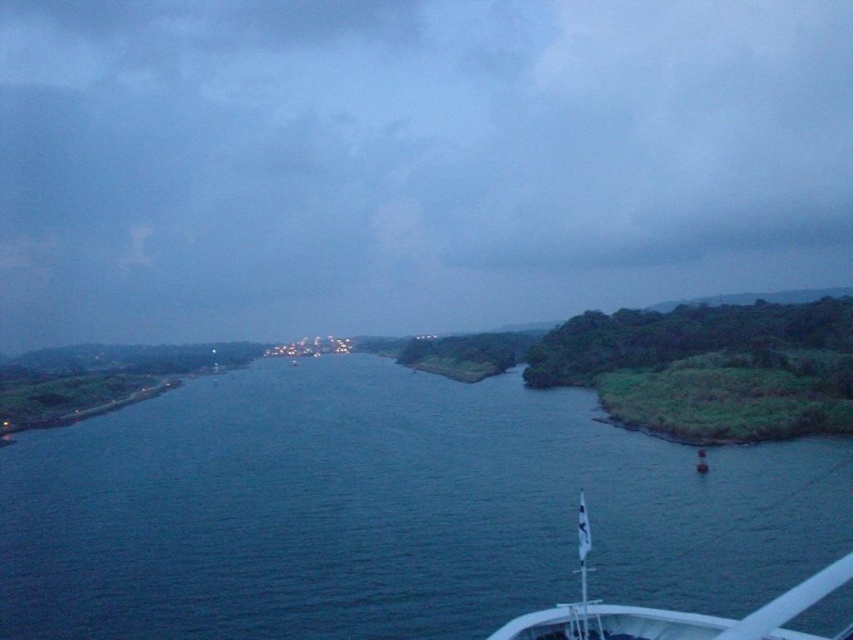
Question: Does dark blue water at center appear on the right side of white matte boat at lower right?

Choices:
 (A) no
 (B) yes

Answer: (A)

Question: Which object is farther from the camera taking this photo?

Choices:
 (A) dark blue water at center
 (B) white matte boat at lower right

Answer: (A)

Question: Is dark blue water at center further to the viewer compared to white matte boat at lower right?

Choices:
 (A) yes
 (B) no

Answer: (A)

Question: Which point is farther to the camera?

Choices:
 (A) dark blue water at center
 (B) white matte boat at lower right

Answer: (A)

Question: Does dark blue water at center appear on the left side of white matte boat at lower right?

Choices:
 (A) no
 (B) yes

Answer: (B)